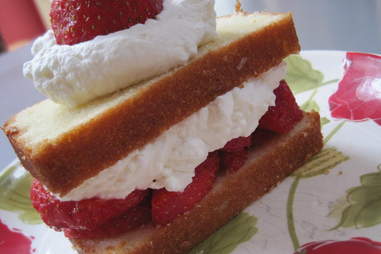
The image size is (381, 254). Identify the location of white plate. (322, 188).